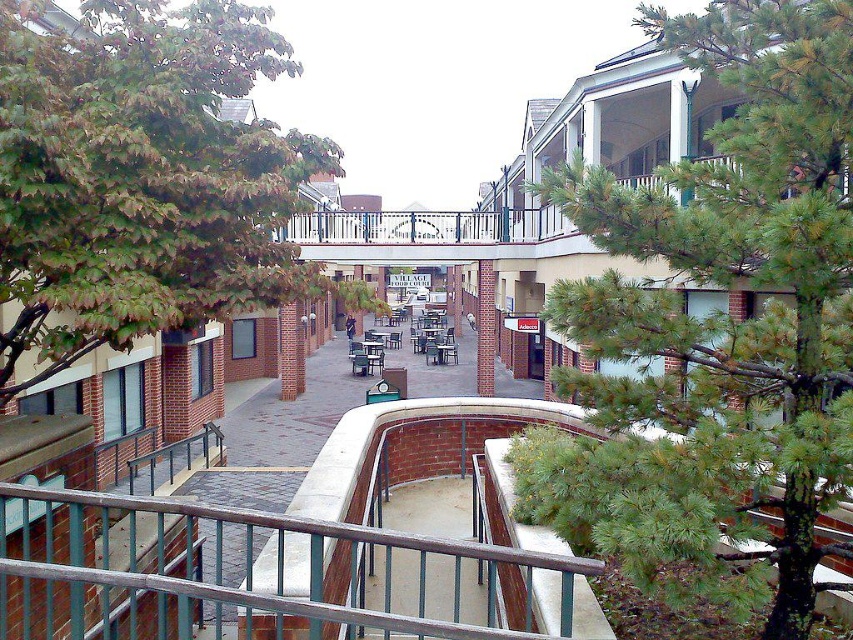
You are standing at the center of the pedestrian plaza and want to take a photo of both the green pine tree at upper right and the green leafy tree at left. Which tree should you position closer to in order to capture both in a single frame without zooming?

To capture both the green pine tree at upper right and the green leafy tree at left in a single frame without zooming, you should position closer to the green leafy tree at left since it is smaller and requires less distance to include both trees in the frame.

You are standing on a balcony overlooking the plaza. There are two points marked on the ground below. The first point is at coordinates point (x=132, y=96) and the second is at point (x=306, y=550). Which point is closer to you?

Point (x=132, y=96) is closer to you because it is further to the viewer than point (x=306, y=550).